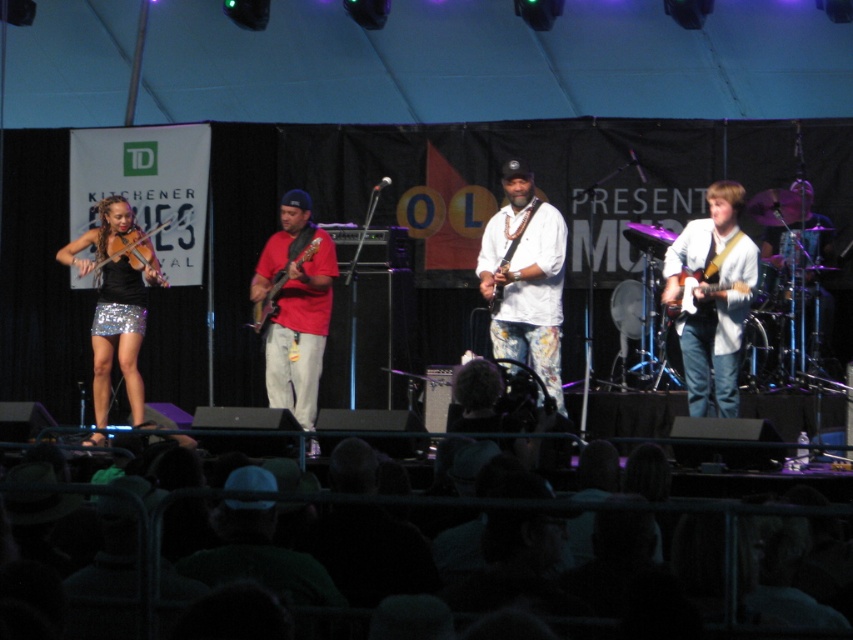
Question: Does matte red guitar at center have a greater width compared to white glossy guitar at right?

Choices:
 (A) yes
 (B) no

Answer: (A)

Question: Estimate the real-world distances between objects in this image. Which object is farther from the white glossy guitar at right?

Choices:
 (A) white glossy guitar at center
 (B) white floral pants at center
 (C) shiny sequined skirt at left
 (D) matte red guitar at center

Answer: (C)

Question: Which point is closer to the camera?

Choices:
 (A) (126, 289)
 (B) (155, 259)
 (C) (257, 314)

Answer: (C)

Question: Does shiny sequined skirt at left have a smaller size compared to matte red guitar at center?

Choices:
 (A) no
 (B) yes

Answer: (A)

Question: Does white matte jacket at right appear under white glossy guitar at right?

Choices:
 (A) yes
 (B) no

Answer: (A)

Question: Which object is the farthest from the matte red guitar at center?

Choices:
 (A) white glossy guitar at right
 (B) white floral pants at center

Answer: (A)